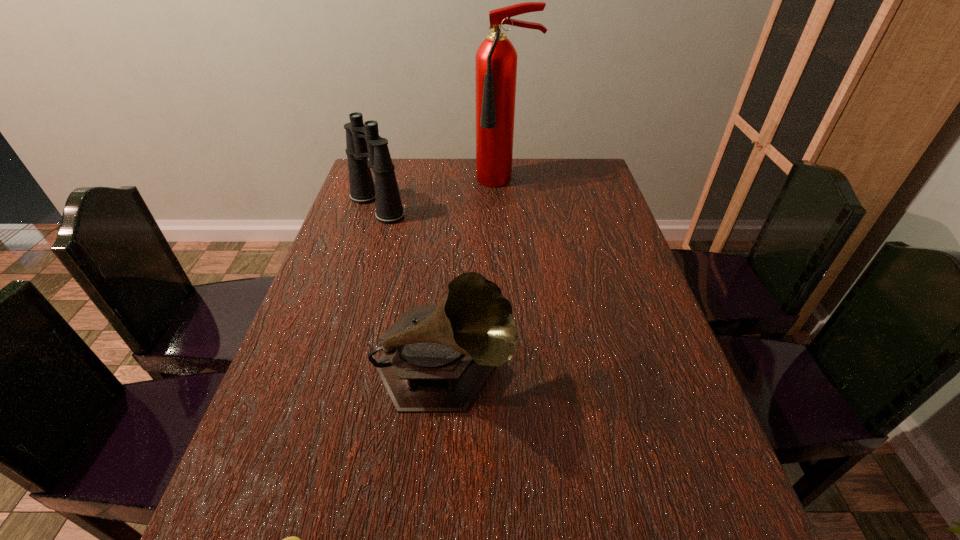
At what (x,y) coordinates should I click in order to perform the action: click on fire extinguisher. Please return your answer as a coordinate pair (x, y). The width and height of the screenshot is (960, 540). Looking at the image, I should click on (496, 58).

This screenshot has height=540, width=960. In order to click on binoculars in this screenshot , I will do `click(363, 141)`.

I want to click on the second nearest object, so click(436, 358).

Identify the location of vacant space located 0.240m at the nozzle of the fire extinguisher. This screenshot has width=960, height=540. (510, 240).

The height and width of the screenshot is (540, 960). Identify the location of free region located on the front of the binoculars. (350, 289).

Image resolution: width=960 pixels, height=540 pixels. I want to click on vacant space located 0.220m on the horn direction of the phonograph record, so click(618, 373).

Find the location of a particular element. The width and height of the screenshot is (960, 540). fire extinguisher that is positioned at the far edge is located at coordinates (496, 58).

Locate an element on the screen. Image resolution: width=960 pixels, height=540 pixels. binoculars present at the far edge is located at coordinates (363, 141).

In order to click on object that is at the left edge in this screenshot , I will do click(363, 141).

The height and width of the screenshot is (540, 960). Find the location of `object that is at the far left corner`. object that is at the far left corner is located at coordinates (363, 141).